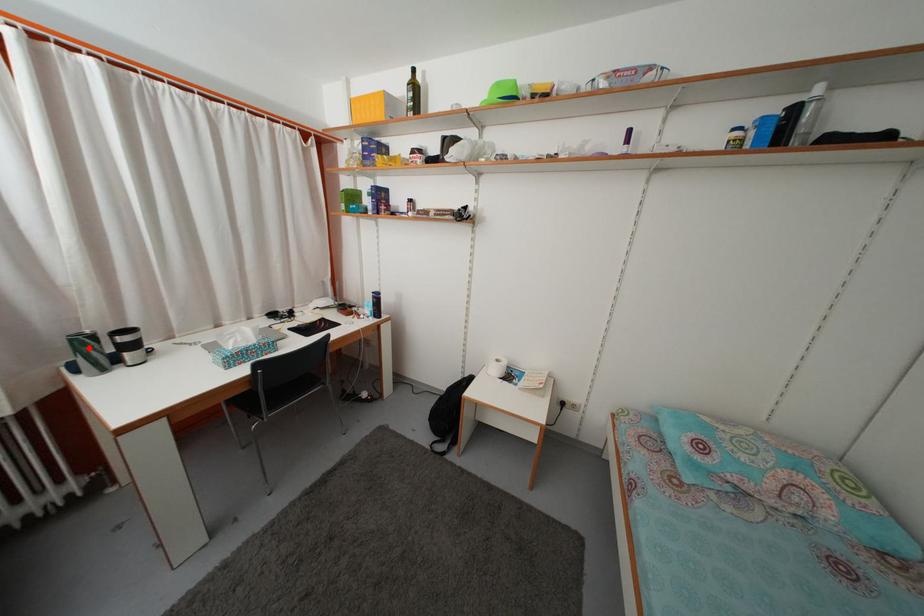
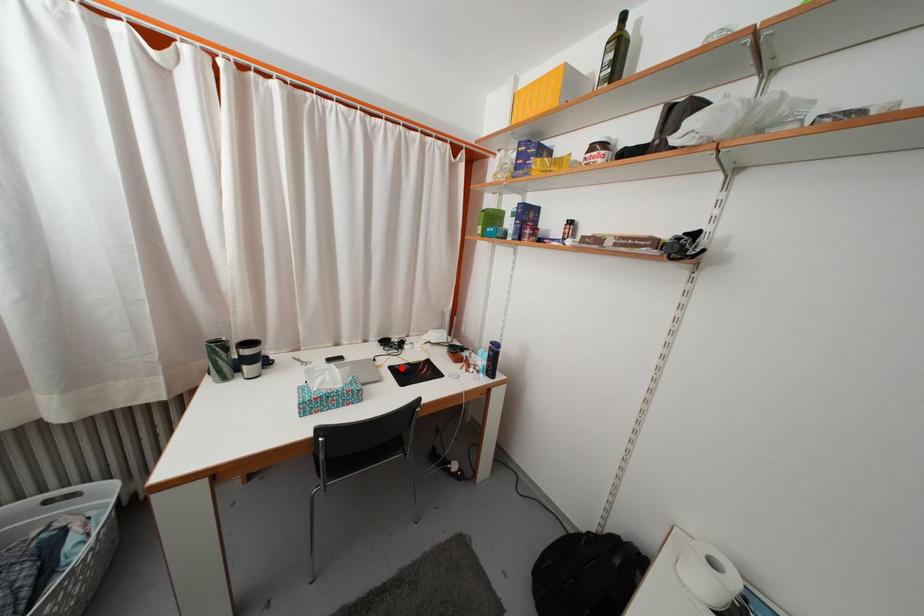
I am providing you with two images of the same scene from different viewpoints. A red point is marked on the first image and another point is marked on the second image. Is the marked point in image1 the same physical position as the marked point in image2?

No